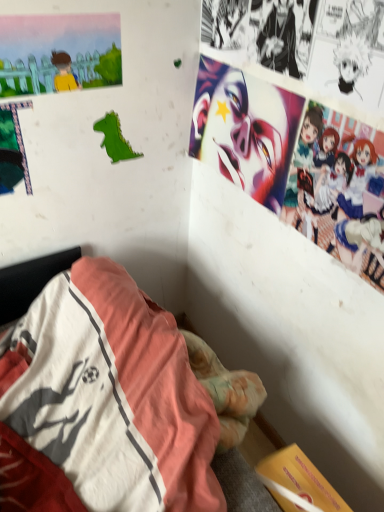
Identify the location of vacant space situated above orange matte poster at lower right, the second poster page when ordered from top to bottom (from a real-world perspective). (307, 487).